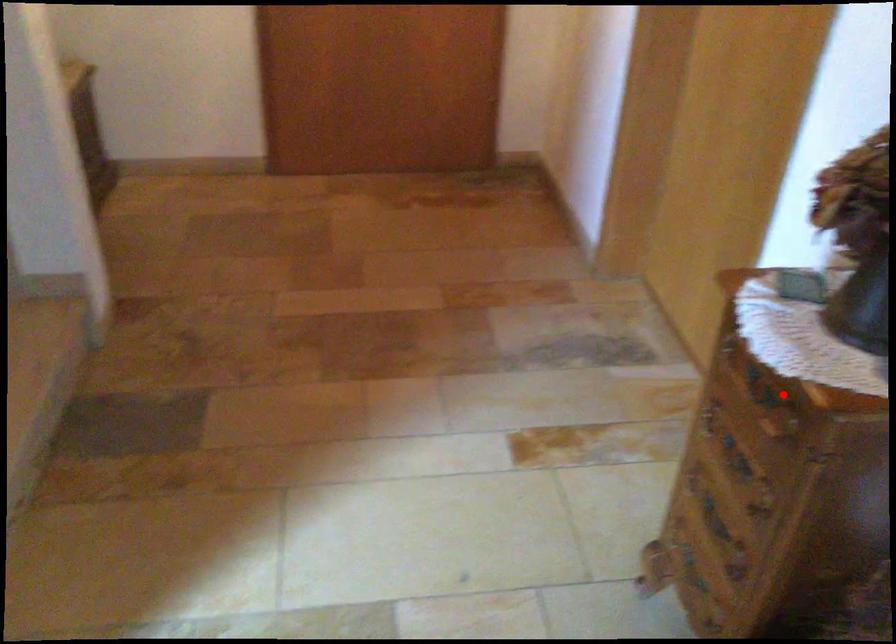
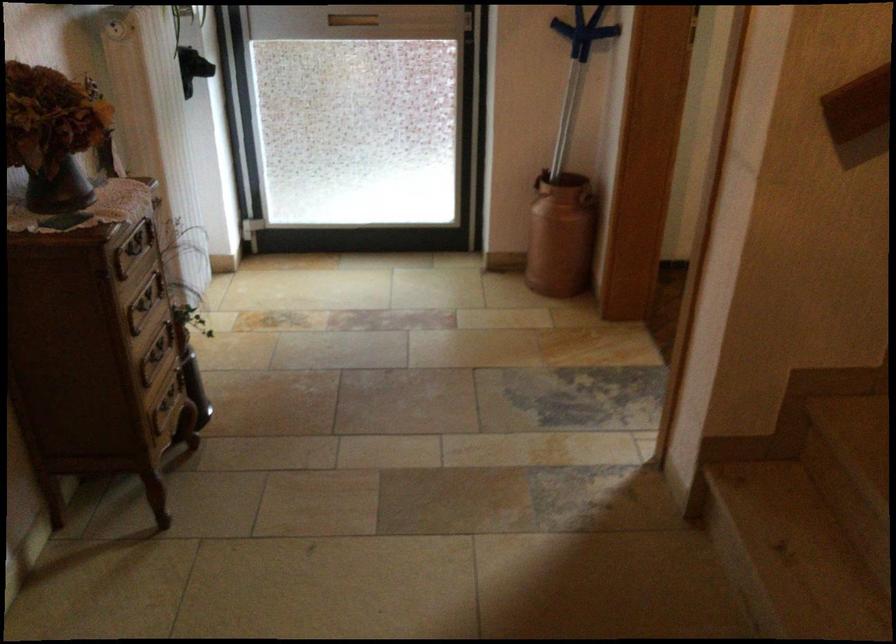
Find the pixel in the second image that matches the highlighted location in the first image.

(133, 248)